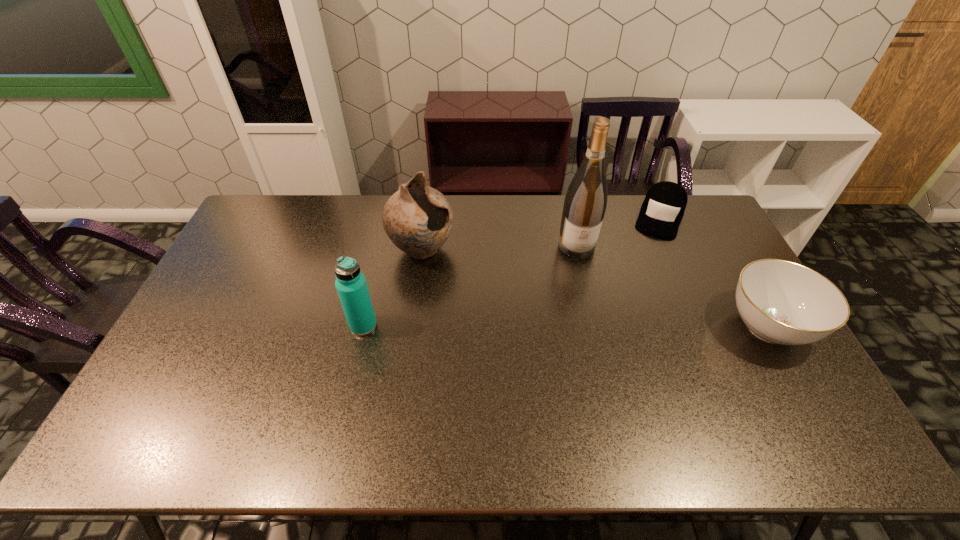
I want to click on vacant space located 0.200m on the label of the third object from left to right, so click(588, 305).

At what (x,y) coordinates should I click in order to perform the action: click on free space located 0.250m from the spout of the pottery. Please return your answer as a coordinate pair (x, y). Looking at the image, I should click on (502, 305).

At what (x,y) coordinates should I click in order to perform the action: click on vacant space located from the spout of the pottery. Please return your answer as a coordinate pair (x, y). The width and height of the screenshot is (960, 540). Looking at the image, I should click on point(476,287).

You are a GUI agent. You are given a task and a screenshot of the screen. Output one action in this format:
    pyautogui.click(x=<x>, y=<y>)
    Task: Click on the vacant region located from the spout of the pottery
    Image resolution: width=960 pixels, height=540 pixels.
    Given the screenshot: What is the action you would take?
    pyautogui.click(x=456, y=273)

The width and height of the screenshot is (960, 540). Find the location of `vacant region located on the front-facing side of the cap`. vacant region located on the front-facing side of the cap is located at coordinates (646, 262).

Find the location of a particular element. vacant space located 0.320m on the front-facing side of the cap is located at coordinates (634, 299).

Find the location of a particular element. The image size is (960, 540). free space located 0.130m on the front-facing side of the cap is located at coordinates (647, 261).

Locate an element on the screen. wine bottle that is at the far edge is located at coordinates (585, 203).

Where is `pottery positioned at the far edge`? pottery positioned at the far edge is located at coordinates (418, 219).

You are a GUI agent. You are given a task and a screenshot of the screen. Output one action in this format:
    pyautogui.click(x=<x>, y=<y>)
    Task: Click on the cap located at the far edge
    
    Given the screenshot: What is the action you would take?
    pyautogui.click(x=662, y=210)